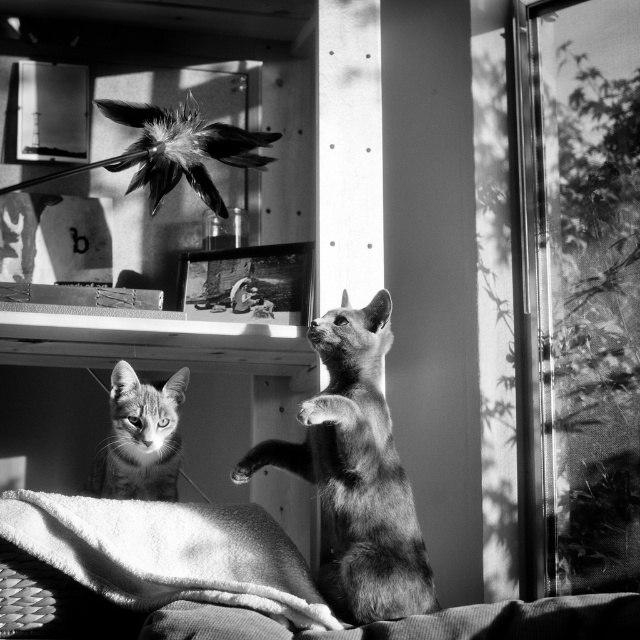
You are a cat owner who wants to ensure your cats can safely reach the transparent mesh at right. Given that the cats are both 2 feet tall, can they reach it?

The transparent mesh at right is 5.67 feet from the viewer. Since the cats are only 2 feet tall, they cannot reach it as their height is insufficient compared to the distance of the mesh.